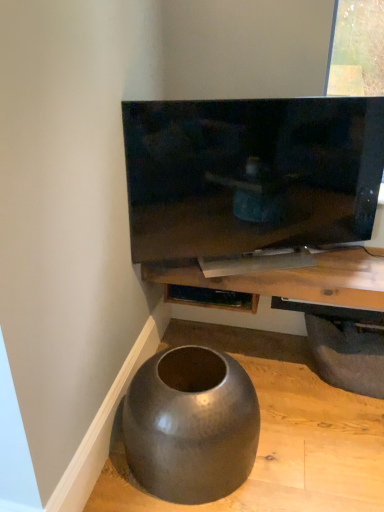
Question: Is wooden shelf at center surrounded by dark gray rubber tire at lower right?

Choices:
 (A) no
 (B) yes

Answer: (A)

Question: Is dark gray rubber tire at lower right outside of wooden shelf at center?

Choices:
 (A) yes
 (B) no

Answer: (A)

Question: Does dark gray rubber tire at lower right have a greater width compared to wooden shelf at center?

Choices:
 (A) yes
 (B) no

Answer: (B)

Question: From a real-world perspective, is dark gray rubber tire at lower right located higher than wooden shelf at center?

Choices:
 (A) yes
 (B) no

Answer: (B)

Question: Does dark gray rubber tire at lower right have a smaller size compared to wooden shelf at center?

Choices:
 (A) yes
 (B) no

Answer: (A)

Question: Looking at their shapes, would you say matte black shelf at lower center is wider or thinner than dark gray rubber tire at lower right?

Choices:
 (A) thin
 (B) wide

Answer: (A)

Question: Is point click(x=210, y=303) positioned closer to the camera than point click(x=370, y=329)?

Choices:
 (A) closer
 (B) farther

Answer: (B)

Question: From the image's perspective, is matte black shelf at lower center above or below dark gray rubber tire at lower right?

Choices:
 (A) above
 (B) below

Answer: (A)

Question: Is matte black shelf at lower center taller or shorter than dark gray rubber tire at lower right?

Choices:
 (A) tall
 (B) short

Answer: (B)

Question: Visually, is dark gray rubber tire at lower right positioned to the left or to the right of matte gray concrete at lower left?

Choices:
 (A) right
 (B) left

Answer: (A)

Question: Is dark gray rubber tire at lower right situated inside matte gray concrete at lower left or outside?

Choices:
 (A) inside
 (B) outside

Answer: (B)

Question: Is dark gray rubber tire at lower right bigger or smaller than matte gray concrete at lower left?

Choices:
 (A) big
 (B) small

Answer: (B)

Question: Is dark gray rubber tire at lower right taller or shorter than matte gray concrete at lower left?

Choices:
 (A) short
 (B) tall

Answer: (B)

Question: In the image, is matte gray concrete at lower left positioned in front of or behind wooden shelf at center?

Choices:
 (A) front
 (B) behind

Answer: (A)

Question: Is point (357, 507) positioned closer to the camera than point (299, 271)?

Choices:
 (A) closer
 (B) farther

Answer: (A)